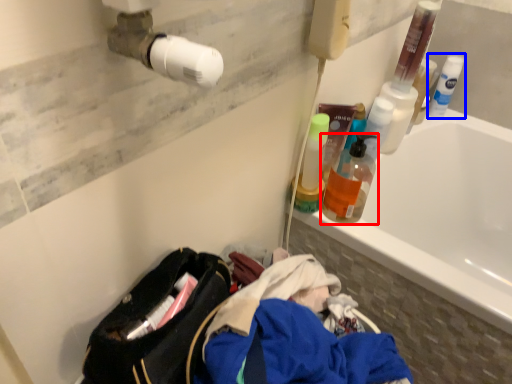
Question: Which object appears closest to the camera in this image, bottle (highlighted by a red box) or cleaning product (highlighted by a blue box)?

Choices:
 (A) bottle
 (B) cleaning product

Answer: (A)